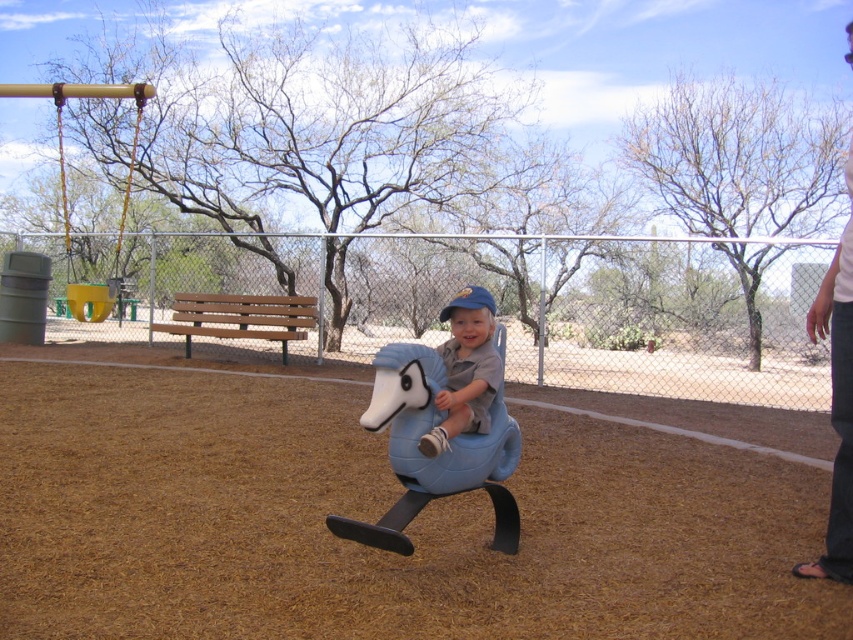
Is white cotton shirt at upper right positioned behind yellow plastic swing at upper left?

No, it is in front of yellow plastic swing at upper left.

Does white cotton shirt at upper right appear on the left side of yellow plastic swing at upper left?

No, white cotton shirt at upper right is not to the left of yellow plastic swing at upper left.

Which is behind, point (828, 291) or point (138, 113)?

Point (138, 113)

What are the coordinates of `white cotton shirt at upper right` in the screenshot? It's located at (837, 400).

Who is taller, white cotton shirt at upper right or matte blue plush horse at center?

white cotton shirt at upper right is taller.

Can you confirm if white cotton shirt at upper right is taller than matte blue plush horse at center?

Correct, white cotton shirt at upper right is much taller as matte blue plush horse at center.

Which is in front, point (845, 429) or point (459, 380)?

Positioned in front is point (845, 429).

This screenshot has width=853, height=640. I want to click on white cotton shirt at upper right, so click(837, 400).

Is blue matte plastic horse at center wider than yellow plastic swing at upper left?

No.

Between point (477, 435) and point (62, 88), which one is positioned behind?

Positioned behind is point (62, 88).

Where is `blue matte plastic horse at center`? blue matte plastic horse at center is located at coordinates (434, 456).

Where is `blue matte plastic horse at center`? blue matte plastic horse at center is located at coordinates (434, 456).